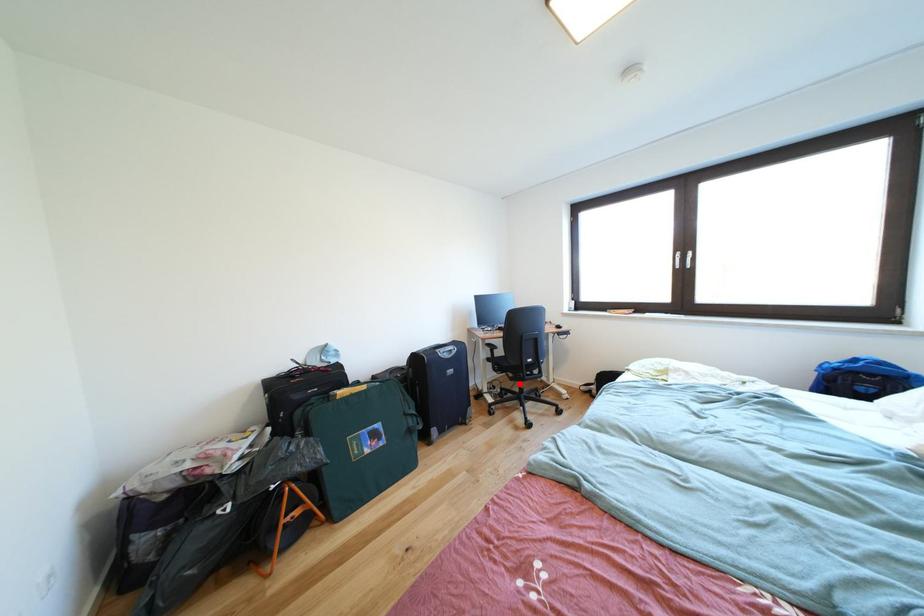
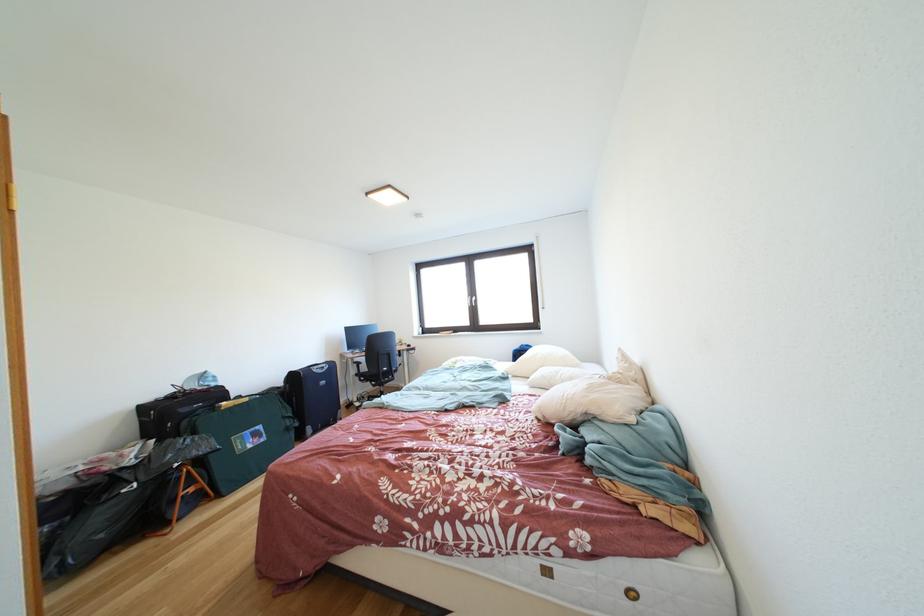
Find the pixel in the second image that matches the highlighted location in the first image.

(383, 391)